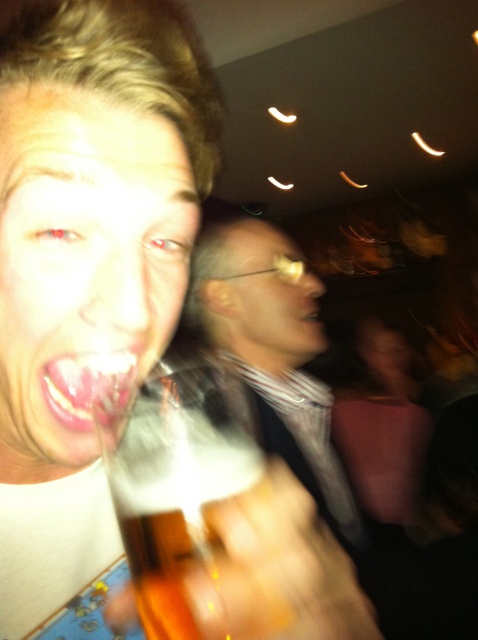
Question: Which point is farther to the camera?

Choices:
 (A) (313, 317)
 (B) (128, 484)
 (C) (273, 291)

Answer: (A)

Question: Which point appears farthest from the camera in this image?

Choices:
 (A) (235, 346)
 (B) (41, 348)

Answer: (A)

Question: Does translucent amber glass at center come behind glossy plastic mouth at center?

Choices:
 (A) yes
 (B) no

Answer: (B)

Question: Which point is closer to the camera?

Choices:
 (A) (186, 605)
 (B) (286, 268)
 (C) (256, 326)

Answer: (A)

Question: Is matte skin face at center behind matte plastic glasses at center?

Choices:
 (A) no
 (B) yes

Answer: (A)

Question: Is translucent amber glass at center thinner than matte plastic glasses at center?

Choices:
 (A) no
 (B) yes

Answer: (B)